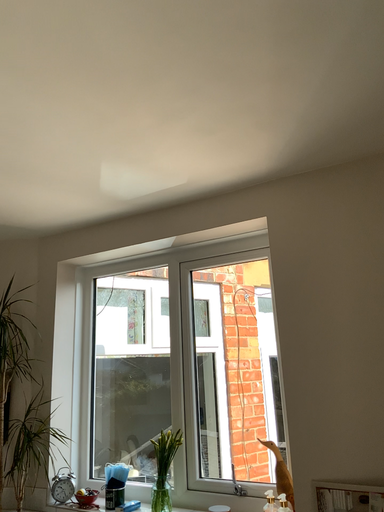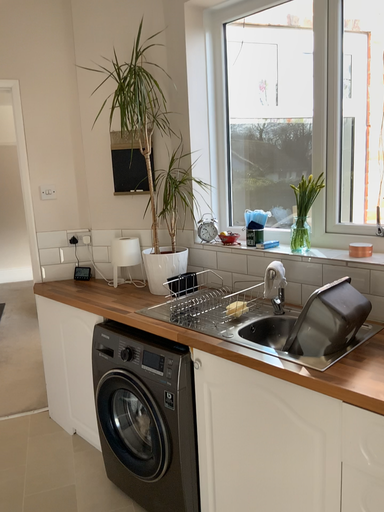
Question: Which way did the camera rotate in the video?

Choices:
 (A) rotated upward
 (B) rotated downward

Answer: (B)